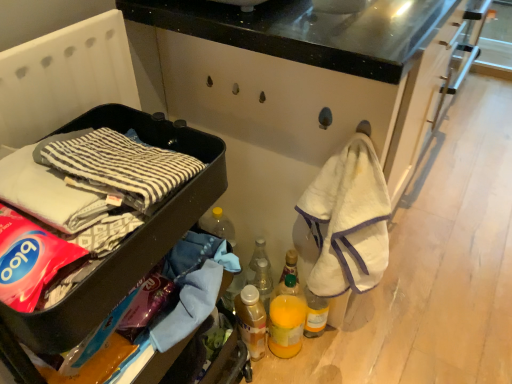
In order to click on free space in front of translucent plastic bottle at lower center, the first bottle ordered from the bottom in this screenshot , I will do point(259,371).